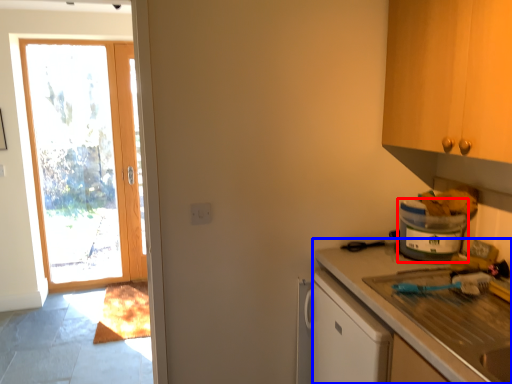
Question: Which object appears closest to the camera in this image, appliance (highlighted by a red box) or countertop (highlighted by a blue box)?

Choices:
 (A) appliance
 (B) countertop

Answer: (B)